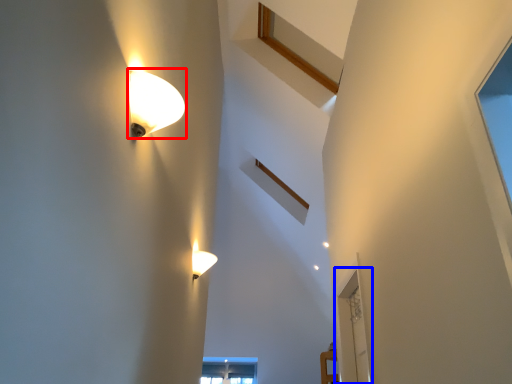
Question: Which of the following is the closest to the observer, lamp (highlighted by a red box) or glass door (highlighted by a blue box)?

Choices:
 (A) lamp
 (B) glass door

Answer: (A)